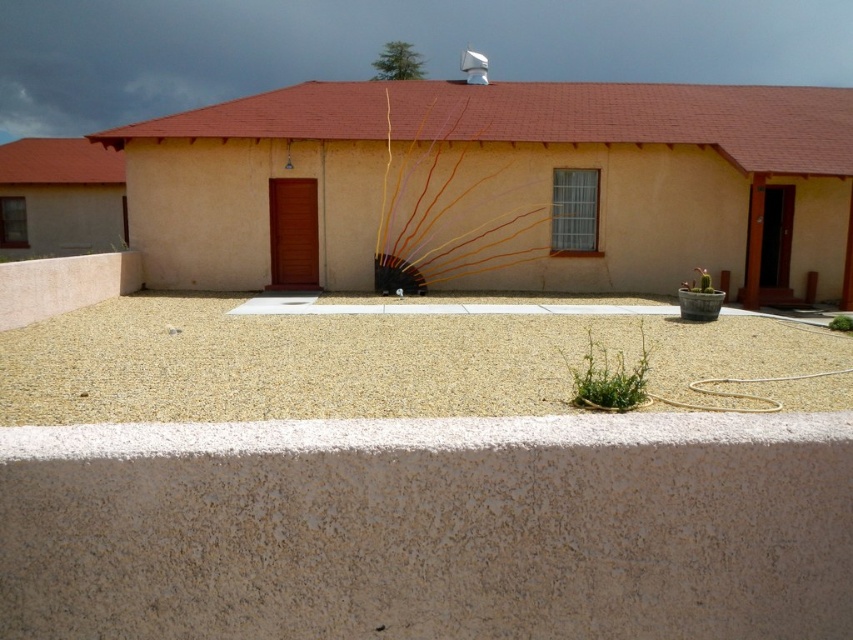
Looking at this image, you are a delivery person approaching the building and need to place a box on the ground. The box requires a stable surface that is higher than the cactus. Which location between the smooth concrete at center and the green matte cactus at right would be suitable?

The smooth concrete at center is much taller than the green matte cactus at right, so placing the box on the smooth concrete at center would provide a stable surface that is higher than the cactus.

From the picture: You are standing in front of the building and want to walk to the door near the center. Which surface will you step on first, the smooth concrete at center or the light beige gravel at center?

The smooth concrete at center is located below the light beige gravel at center, so you will step on the light beige gravel at center first before reaching the smooth concrete at center.

You are a gardener planning to place a new decorative stone that is 1 meter wide in the courtyard. The smooth concrete at center and green matte cactus at right are already there. Which object can accommodate the stone without overlapping?

The smooth concrete at center can accommodate the stone since its width is larger than the green matte cactus at right, which is narrower than the stone.